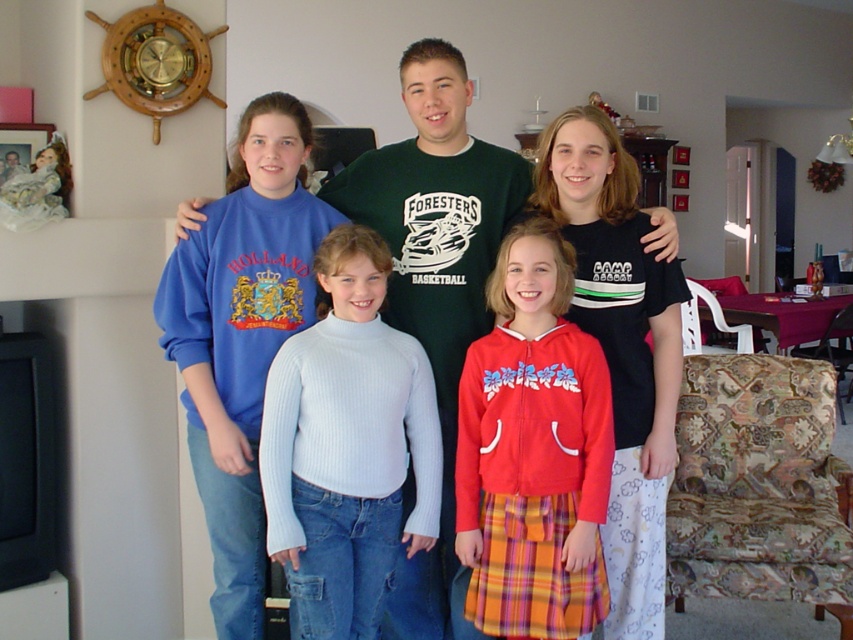
Question: Where is white ribbed sweater at center located in relation to matte blue sweatshirt at upper left in the image?

Choices:
 (A) right
 (B) left

Answer: (B)

Question: Which of the following is the closest to the observer?

Choices:
 (A) (564, 403)
 (B) (206, 200)

Answer: (A)

Question: Can you confirm if white ribbed sweater at center is wider than red fleece jacket at center?

Choices:
 (A) yes
 (B) no

Answer: (A)

Question: Which of the following is the farthest from the observer?

Choices:
 (A) white ribbed sweater at center
 (B) matte blue sweatshirt at upper left

Answer: (B)

Question: Does white ribbed sweater at center come in front of red fleece jacket at center?

Choices:
 (A) yes
 (B) no

Answer: (B)

Question: Which is farther from the matte blue sweatshirt at upper left?

Choices:
 (A) red fleece jacket at center
 (B) white ribbed sweater at center

Answer: (B)